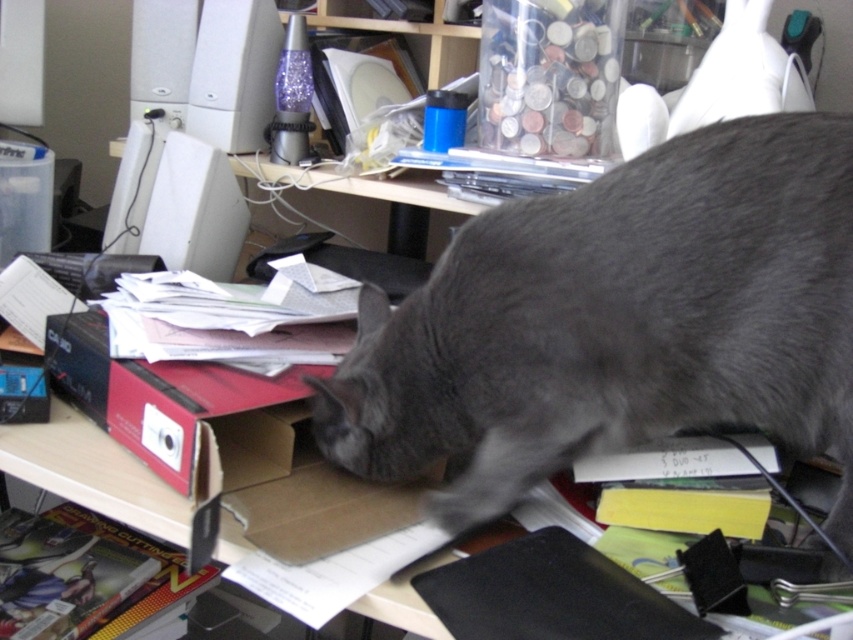
You are organizing the desk and need to move the gray fur cat at center and the white plastic computer at upper left. Which object is closer to the edge of the desk?

The gray fur cat at center is closer to the edge of the desk because it is located below the white plastic computer at upper left, implying it is positioned lower on the desk.

You are a delivery person who needs to place a small package on the desk. The package must be placed on a surface that is taller than the gray fur cat at center. Can you place the package on the white plastic computer at upper left?

The gray fur cat at center has a greater height compared to the white plastic computer at upper left. Since the package needs to be placed on a surface taller than the cat, the white plastic computer at upper left is not tall enough. Find another surface.

From the picture: You are standing at the edge of the desk looking towards the gray cat. Which of the two points, point (792,198) or point (215,173), is closer to you?

Point (792,198) is closer to the viewer than point (215,173).